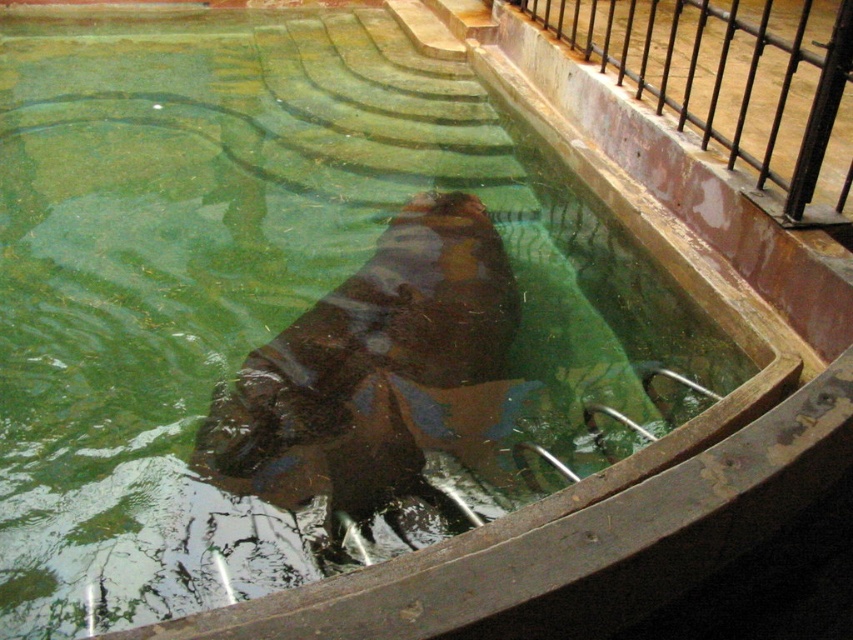
This screenshot has height=640, width=853. I want to click on brown matte hippo at center, so click(370, 369).

Is brown matte hippo at center to the left of black metal rail at upper right from the viewer's perspective?

Yes, brown matte hippo at center is to the left of black metal rail at upper right.

Is point (466, 208) positioned before point (706, 122)?

No, (466, 208) is behind (706, 122).

Where is `brown matte hippo at center`? This screenshot has width=853, height=640. brown matte hippo at center is located at coordinates (370, 369).